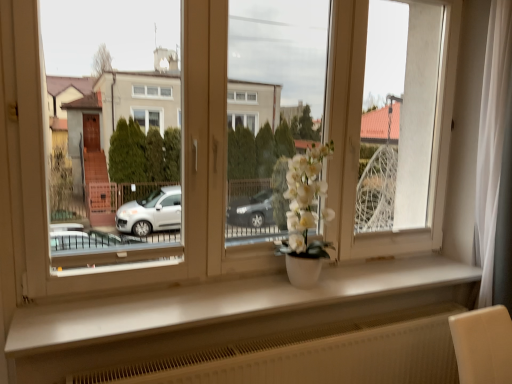
Question: Should I look upward or downward to see white matte vase at center?

Choices:
 (A) down
 (B) up

Answer: (A)

Question: Does white matte flower pot at center appear on the right side of white matte window sill at center?

Choices:
 (A) no
 (B) yes

Answer: (A)

Question: Is white matte flower pot at center in contact with white matte window sill at center?

Choices:
 (A) no
 (B) yes

Answer: (A)

Question: Is white matte flower pot at center shorter than white matte window sill at center?

Choices:
 (A) yes
 (B) no

Answer: (B)

Question: Considering the relative sizes of white matte flower pot at center and white matte window sill at center in the image provided, is white matte flower pot at center thinner than white matte window sill at center?

Choices:
 (A) yes
 (B) no

Answer: (A)

Question: From the image's perspective, is white matte flower pot at center above white matte window sill at center?

Choices:
 (A) no
 (B) yes

Answer: (B)

Question: From the image's perspective, is white matte flower pot at center beneath white matte window sill at center?

Choices:
 (A) no
 (B) yes

Answer: (A)

Question: From a real-world perspective, is white matte window sill at center located higher than white matte vase at center?

Choices:
 (A) yes
 (B) no

Answer: (B)

Question: From the image's perspective, would you say white matte window sill at center is positioned over white matte vase at center?

Choices:
 (A) no
 (B) yes

Answer: (A)

Question: Is white matte window sill at center next to white matte vase at center?

Choices:
 (A) yes
 (B) no

Answer: (B)

Question: Does white matte window sill at center have a smaller size compared to white matte vase at center?

Choices:
 (A) yes
 (B) no

Answer: (A)

Question: Is white matte window sill at center outside white matte vase at center?

Choices:
 (A) yes
 (B) no

Answer: (A)

Question: From the image's perspective, is white matte window sill at center located beneath white matte vase at center?

Choices:
 (A) no
 (B) yes

Answer: (B)

Question: From the image's perspective, is white matte vase at center below white matte flower pot at center?

Choices:
 (A) yes
 (B) no

Answer: (A)